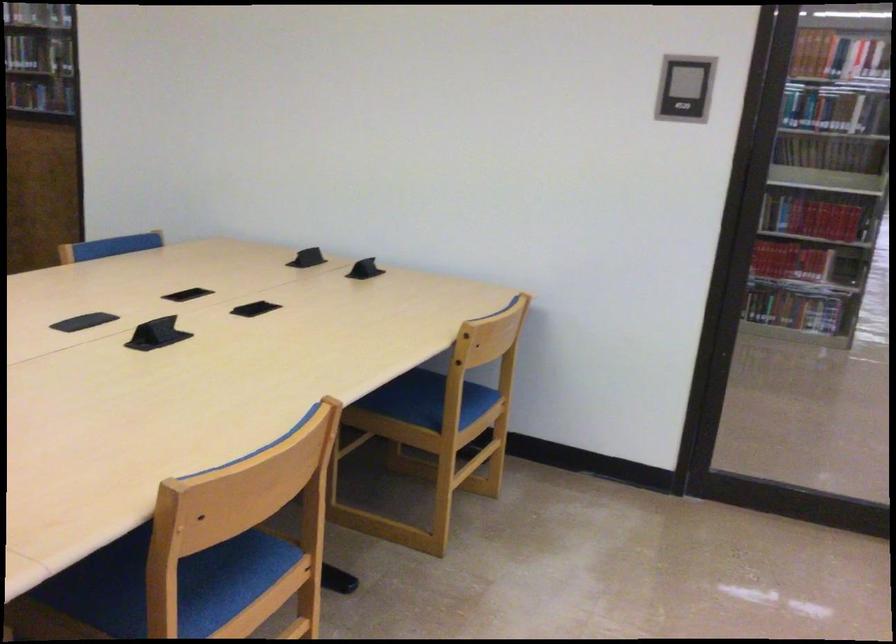
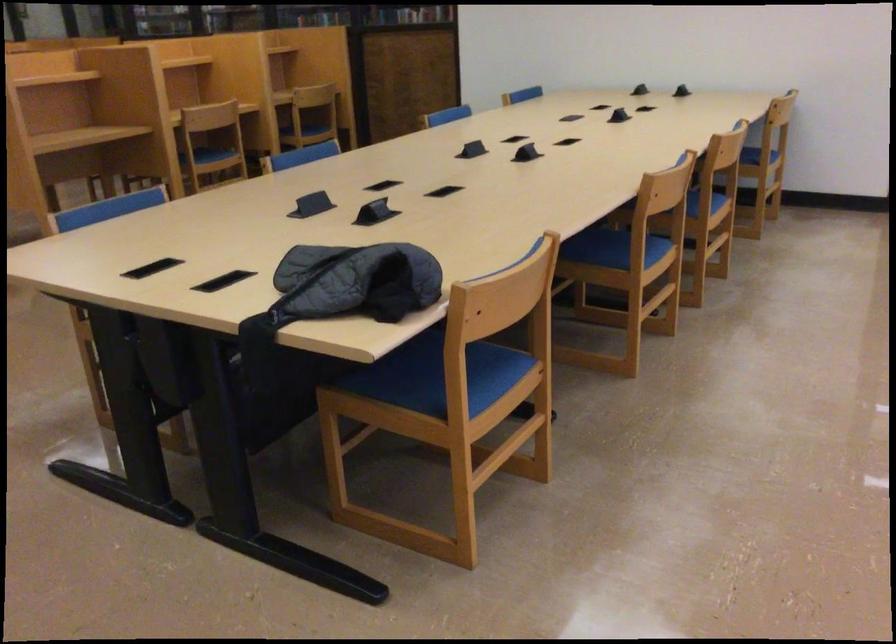
Which direction would the cameraman need to move to produce the second image?

The cameraman walked toward left, backward.